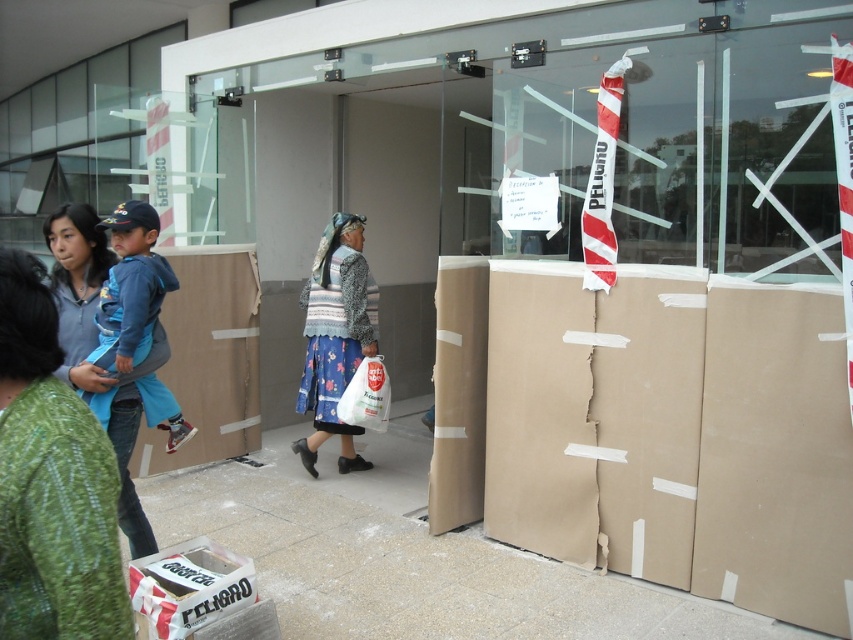
Question: Which object is the farthest from the white plastic bag at center?

Choices:
 (A) knitted wool sweater at center
 (B) white cardboard box at lower left
 (C) green textured sweater at center

Answer: (C)

Question: Which of the following is the farthest from the observer?

Choices:
 (A) (361, 365)
 (B) (119, 499)

Answer: (A)

Question: Is knitted wool sweater at center bigger than white cardboard box at lower left?

Choices:
 (A) yes
 (B) no

Answer: (A)

Question: Can you confirm if knitted wool sweater at center is positioned above white cardboard box at lower left?

Choices:
 (A) no
 (B) yes

Answer: (B)

Question: Which of these objects is positioned closest to the knitted wool sweater at center?

Choices:
 (A) white plastic bag at center
 (B) smooth concrete pavement at lower center
 (C) matte gray hoodie at left

Answer: (A)

Question: Is green textured sweater at center above white cardboard box at lower left?

Choices:
 (A) no
 (B) yes

Answer: (B)